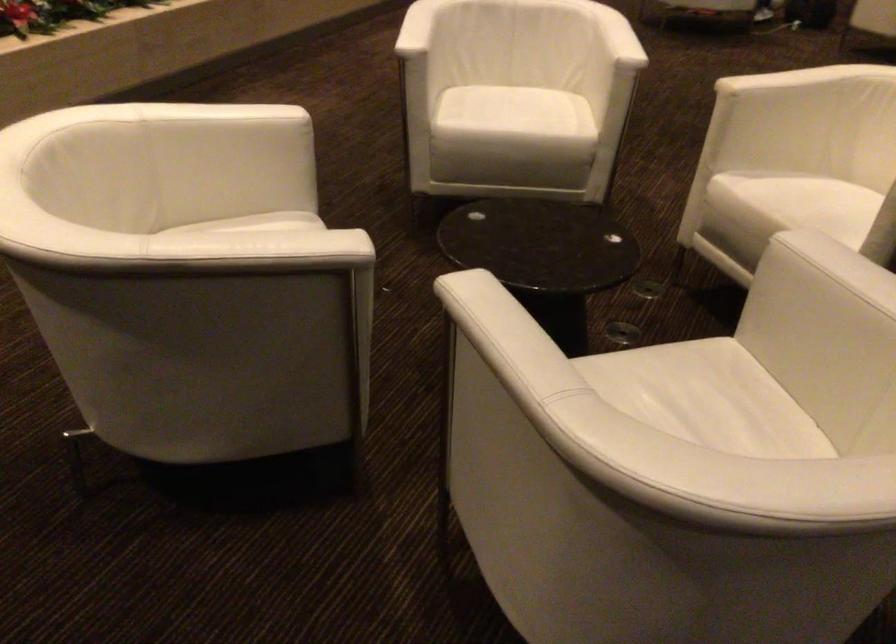
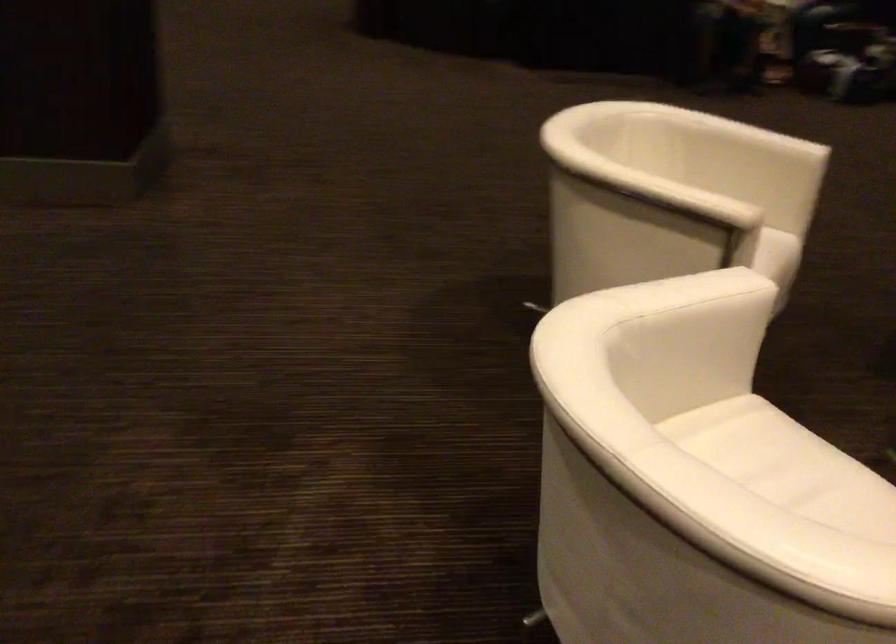
Locate, in the second image, the point that corresponds to [541,102] in the first image.

(767, 453)